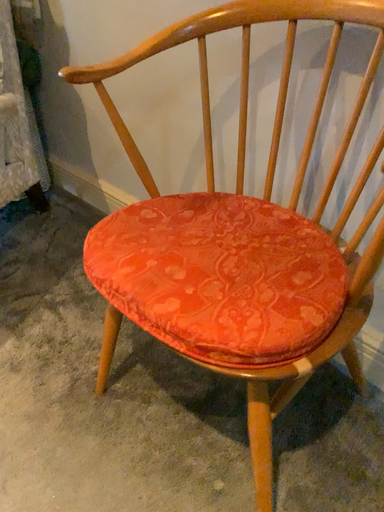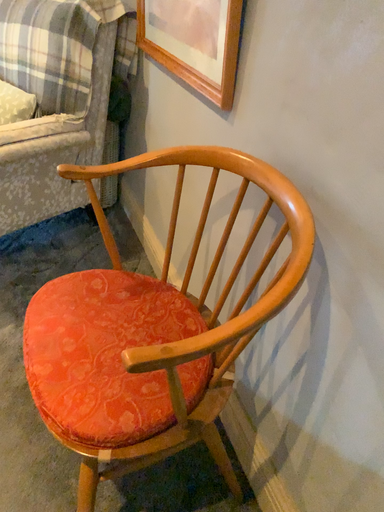
Question: How did the camera likely rotate when shooting the video?

Choices:
 (A) rotated left
 (B) rotated right

Answer: (A)